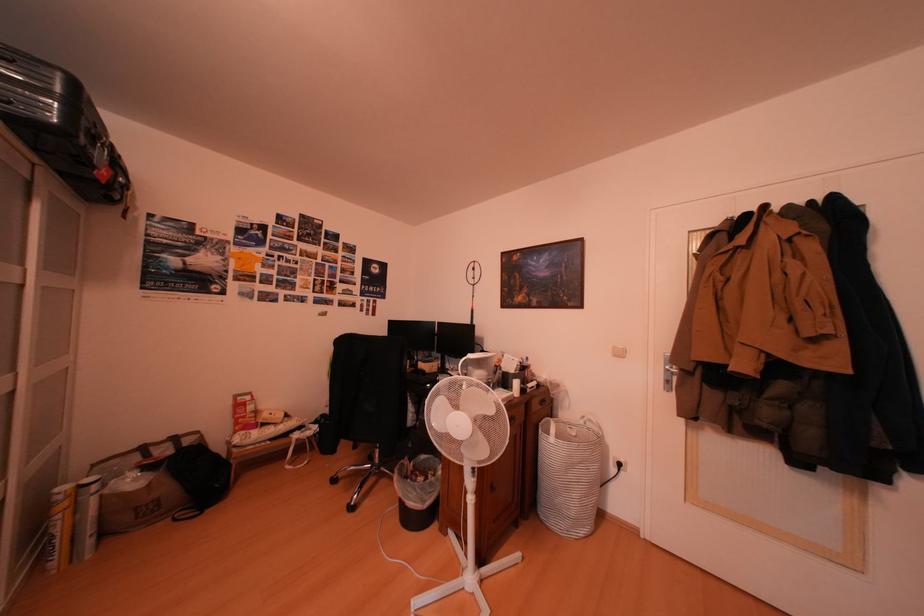
The location [418,492] corresponds to which object?

It refers to a black trash can.